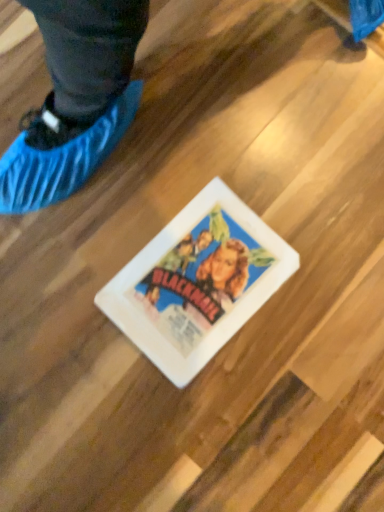
The height and width of the screenshot is (512, 384). What do you see at coordinates (197, 282) in the screenshot? I see `white glossy book cover at center` at bounding box center [197, 282].

Identify the location of white glossy book cover at center. click(x=197, y=282).

This screenshot has width=384, height=512. Identify the location of white glossy book cover at center. (197, 282).